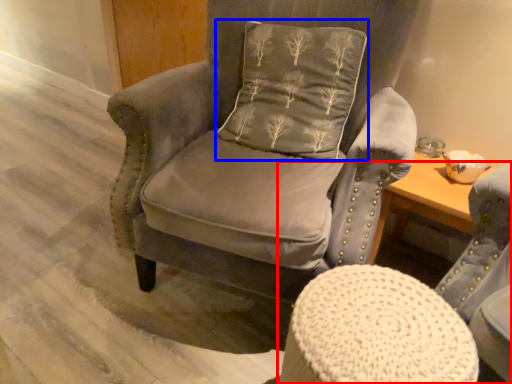
Question: Which object appears farthest to the camera in this image, chair (highlighted by a red box) or pillow (highlighted by a blue box)?

Choices:
 (A) chair
 (B) pillow

Answer: (B)